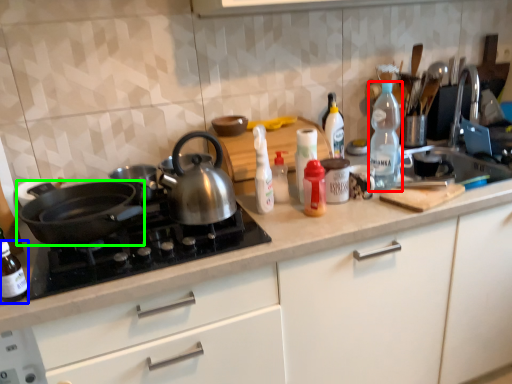
Question: Which object is positioned farthest from bottle (highlighted by a red box)? Select from bottle (highlighted by a blue box) and kitchen appliance (highlighted by a green box).

Choices:
 (A) bottle
 (B) kitchen appliance

Answer: (A)